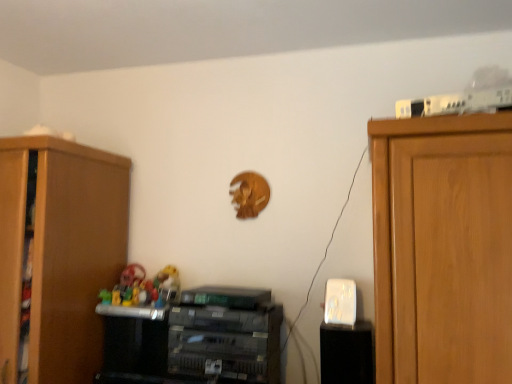
Question: Can you confirm if rubber toys at center is positioned to the left of metallic gray printer at center, the 2th cabinetry in the left-to-right sequence?

Choices:
 (A) yes
 (B) no

Answer: (A)

Question: Is rubber toys at center wider than metallic gray printer at center, arranged as the 2th cabinetry when viewed from the right?

Choices:
 (A) no
 (B) yes

Answer: (A)

Question: Is metallic gray printer at center, the 2th cabinetry in the left-to-right sequence, completely or partially inside rubber toys at center?

Choices:
 (A) no
 (B) yes

Answer: (A)

Question: Is rubber toys at center further to the viewer compared to metallic gray printer at center, arranged as the 2th cabinetry when viewed from the right?

Choices:
 (A) no
 (B) yes

Answer: (B)

Question: Can you confirm if rubber toys at center is shorter than metallic gray printer at center, arranged as the 2th cabinetry when viewed from the right?

Choices:
 (A) no
 (B) yes

Answer: (B)

Question: Considering the relative sizes of rubber toys at center and metallic gray printer at center, arranged as the 2th cabinetry when viewed from the right, in the image provided, is rubber toys at center thinner than metallic gray printer at center, arranged as the 2th cabinetry when viewed from the right,?

Choices:
 (A) no
 (B) yes

Answer: (B)

Question: From the image's perspective, would you say metallic gray printer at center, the 2th cabinetry in the left-to-right sequence, is positioned over wooden cabinet at left, placed as the third cabinetry when sorted from right to left?

Choices:
 (A) yes
 (B) no

Answer: (B)

Question: Could you tell me if metallic gray printer at center, the 2th cabinetry in the left-to-right sequence, is turned towards wooden cabinet at left, placed as the third cabinetry when sorted from right to left?

Choices:
 (A) yes
 (B) no

Answer: (B)

Question: Can you confirm if metallic gray printer at center, the 2th cabinetry in the left-to-right sequence, is shorter than wooden cabinet at left, the first cabinetry in the left-to-right sequence?

Choices:
 (A) yes
 (B) no

Answer: (A)

Question: From a real-world perspective, is metallic gray printer at center, the 2th cabinetry in the left-to-right sequence, physically below wooden cabinet at left, the first cabinetry in the left-to-right sequence?

Choices:
 (A) yes
 (B) no

Answer: (A)

Question: Is metallic gray printer at center, the 2th cabinetry in the left-to-right sequence, at the left side of wooden cabinet at left, the first cabinetry in the left-to-right sequence?

Choices:
 (A) yes
 (B) no

Answer: (B)

Question: Is metallic gray printer at center, arranged as the 2th cabinetry when viewed from the right, not near wooden cabinet at left, placed as the third cabinetry when sorted from right to left?

Choices:
 (A) no
 (B) yes

Answer: (A)

Question: Considering the relative sizes of wooden cabinet at left, the first cabinetry in the left-to-right sequence, and metallic gray printer at center, the 2th cabinetry in the left-to-right sequence, in the image provided, is wooden cabinet at left, the first cabinetry in the left-to-right sequence, thinner than metallic gray printer at center, the 2th cabinetry in the left-to-right sequence,?

Choices:
 (A) yes
 (B) no

Answer: (B)